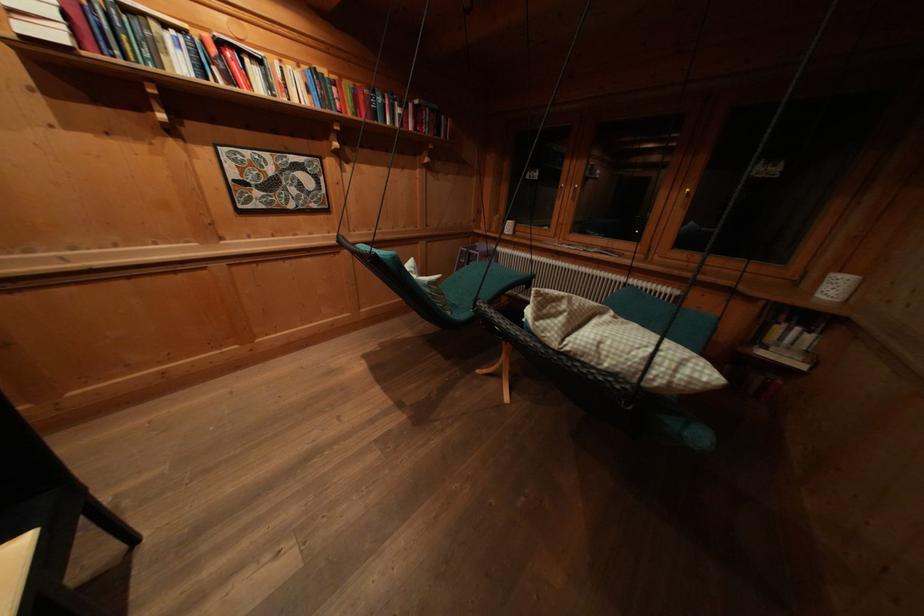
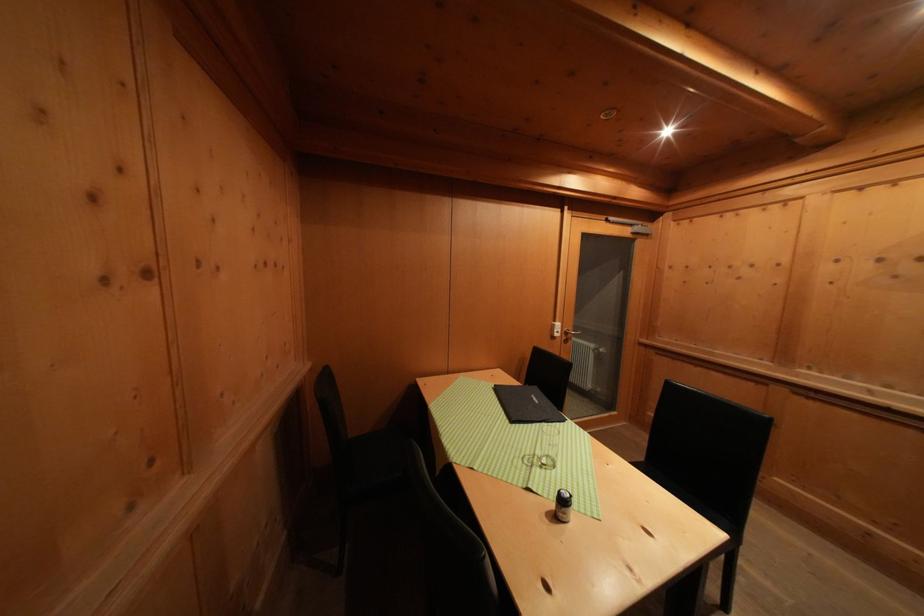
Question: The camera is either moving clockwise (left) or counter-clockwise (right) around the object. The first image is from the beginning of the video and the second image is from the end. Is the camera moving left or right when shooting the video?

Choices:
 (A) Left
 (B) Right

Answer: (B)